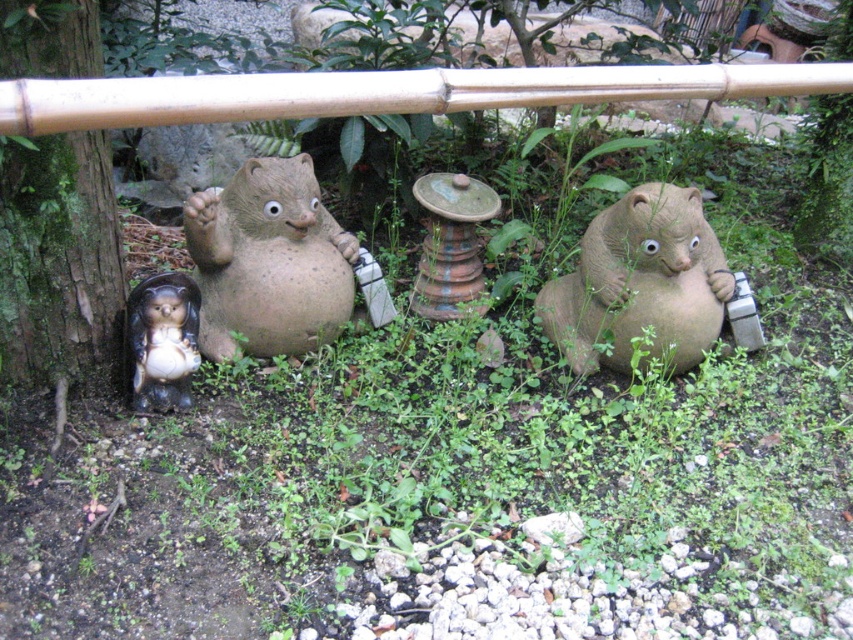
You are a sculptor who wants to display two bears in a garden. The matte clay bear at center and the matte ceramic bear at center are both available. If you want to place them so that one is taller than the other, which one should you choose as the taller one?

The matte clay bear at center has a greater height compared to the matte ceramic bear at center, so you should choose the matte clay bear at center as the taller one.

You are a gardener who needs to place a new decorative pot that is 1 meter in diameter between the matte clay bear at center and the matte ceramic bear at center. Based on the scene description, will the pot fit between them without overlapping either bear?

The distance between the matte clay bear at center and the matte ceramic bear at center is 82.01 centimeters. Since the pot is 1 meter in diameter, which is 100 centimeters, the pot will not fit between them as the space is smaller than the pot.

You are standing in the garden and want to place a new decorative item at the exact location where the green mossy bark at left is currently located. According to the scene description, where should you place it?

The green mossy bark at left is located at the 2D coordinates point [59,259], so you should place the new decorative item there.